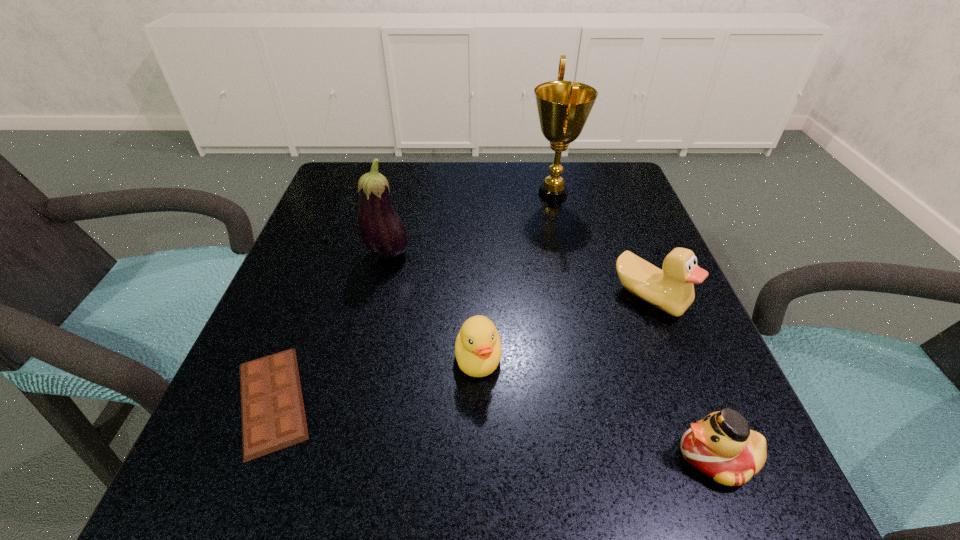
Find the location of a particular element. blank region between the fourth shortest object and the third object from right to left is located at coordinates (601, 246).

You are a GUI agent. You are given a task and a screenshot of the screen. Output one action in this format:
    pyautogui.click(x=<x>, y=<y>)
    Task: Click on the free space between the nearest duck and the shortest object
    This screenshot has height=540, width=960.
    Given the screenshot: What is the action you would take?
    pyautogui.click(x=494, y=428)

I want to click on unoccupied position between the shortest object and the nearest duck, so click(x=494, y=428).

Image resolution: width=960 pixels, height=540 pixels. Find the location of `empty space between the shortest object and the nearest duck`. empty space between the shortest object and the nearest duck is located at coordinates (494, 428).

Identify the location of free space between the fourth object from right to left and the farthest object. Image resolution: width=960 pixels, height=540 pixels. (516, 276).

The image size is (960, 540). I want to click on object that is the second closest to the fifth shortest object, so click(273, 417).

The height and width of the screenshot is (540, 960). Find the location of `the closest object to the nearest duck`. the closest object to the nearest duck is located at coordinates (672, 290).

Locate which duck ranks in proximity to the fifth object from right to left. Please provide its 2D coordinates. Your answer should be formatted as a tuple, i.e. [(x, y)], where the tuple contains the x and y coordinates of a point satisfying the conditions above.

[(478, 350)]

Identify which duck is the second closest to the leftmost duck. Please provide its 2D coordinates. Your answer should be formatted as a tuple, i.e. [(x, y)], where the tuple contains the x and y coordinates of a point satisfying the conditions above.

[(722, 446)]

You are a GUI agent. You are given a task and a screenshot of the screen. Output one action in this format:
    pyautogui.click(x=<x>, y=<y>)
    Task: Click on the vacant position in the image that satisfies the following two spatial constraints: 1. on the front view with handles of the fourth object from left to right; 2. at the beak of the second farthest duck
    This screenshot has width=960, height=540.
    Given the screenshot: What is the action you would take?
    pyautogui.click(x=589, y=358)